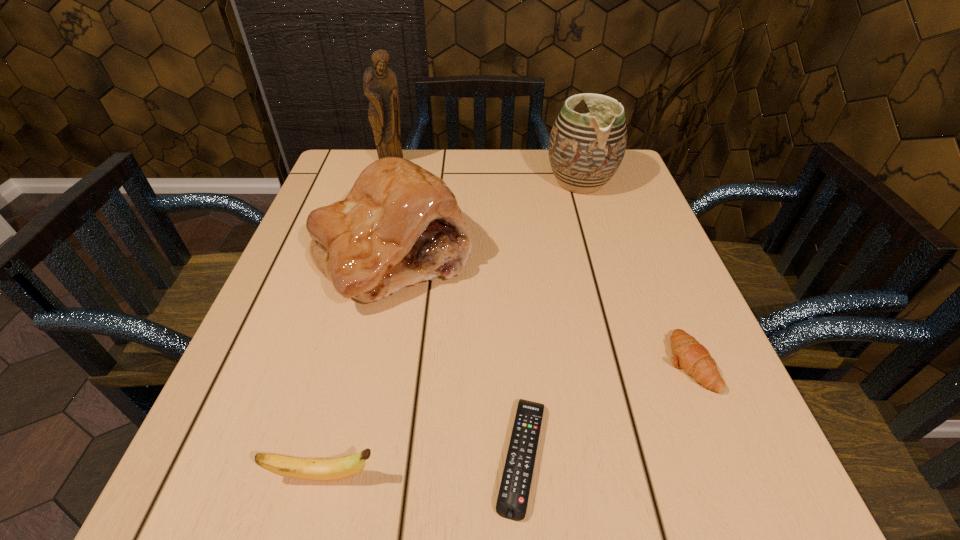
At what (x,y) coordinates should I click in order to perform the action: click on banana at the left edge. Please return your answer as a coordinate pair (x, y). This screenshot has height=540, width=960. Looking at the image, I should click on (332, 469).

The width and height of the screenshot is (960, 540). Identify the location of pottery located in the right edge section of the desktop. (585, 150).

The image size is (960, 540). I want to click on crescent roll positioned at the right edge, so click(x=688, y=354).

Locate an element on the screen. object at the far left corner is located at coordinates coord(380,86).

Where is `object situated at the near left corner`? This screenshot has width=960, height=540. object situated at the near left corner is located at coordinates (332, 469).

At what (x,y) coordinates should I click in order to perform the action: click on object that is at the far right corner. Please return your answer as a coordinate pair (x, y). This screenshot has height=540, width=960. Looking at the image, I should click on (585, 150).

Identify the location of vacant area at the far edge. (540, 151).

In the image, there is a desktop. At what (x,y) coordinates should I click in order to perform the action: click on blank space at the near edge. Please return your answer as a coordinate pair (x, y). Looking at the image, I should click on (559, 472).

Where is `vacant space at the left edge of the desktop`? vacant space at the left edge of the desktop is located at coordinates (319, 300).

Find the location of a particular element. The width and height of the screenshot is (960, 540). vacant region at the right edge of the desktop is located at coordinates (604, 261).